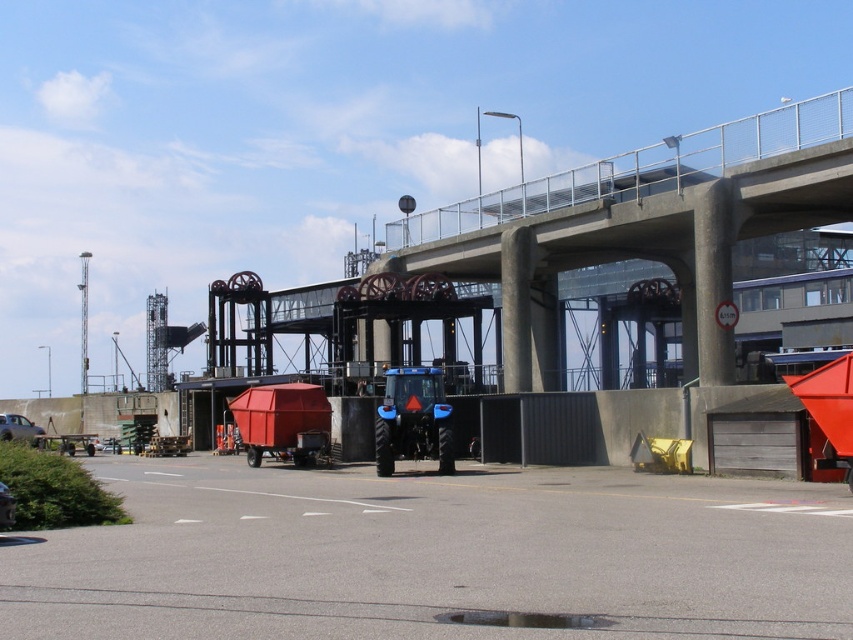
Question: Does brushed metal car at lower left come in front of metallic silver car at lower left?

Choices:
 (A) no
 (B) yes

Answer: (A)

Question: Which object is closer to the camera taking this photo?

Choices:
 (A) brushed metal car at lower left
 (B) metallic silver car at lower left

Answer: (B)

Question: Which point is farther from the camera taking this photo?

Choices:
 (A) (35, 436)
 (B) (4, 484)

Answer: (A)

Question: Does brushed metal car at lower left come in front of metallic silver car at lower left?

Choices:
 (A) no
 (B) yes

Answer: (A)

Question: Is brushed metal car at lower left closer to the viewer compared to metallic silver car at lower left?

Choices:
 (A) yes
 (B) no

Answer: (B)